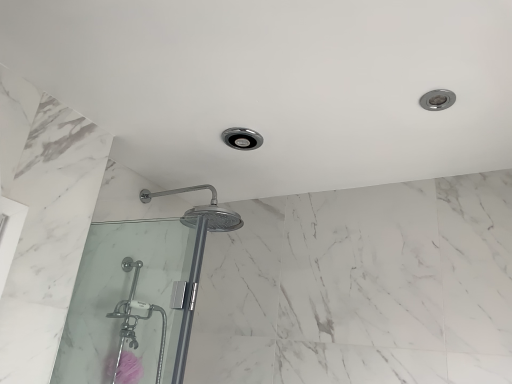
What is the approximate width of pink matte flower at lower left?

4.99 inches.

Describe the element at coordinates (128, 368) in the screenshot. The width and height of the screenshot is (512, 384). I see `pink matte flower at lower left` at that location.

Locate an element on the screen. pink matte flower at lower left is located at coordinates (128, 368).

The width and height of the screenshot is (512, 384). Describe the element at coordinates (133, 300) in the screenshot. I see `clear glass shower door at lower left` at that location.

Measure the distance between point (125, 270) and camera.

They are 5.64 feet apart.

Locate an element on the screen. This screenshot has height=384, width=512. clear glass shower door at lower left is located at coordinates click(x=133, y=300).

You are a GUI agent. You are given a task and a screenshot of the screen. Output one action in this format:
    pyautogui.click(x=<x>, y=<y>)
    Task: Click on the pink matte flower at lower left
    The image size is (512, 384).
    Given the screenshot: What is the action you would take?
    pyautogui.click(x=128, y=368)

Is clear glass shower door at lower left to the left of pink matte flower at lower left from the viewer's perspective?

No, clear glass shower door at lower left is not to the left of pink matte flower at lower left.

Is clear glass shower door at lower left closer to camera compared to pink matte flower at lower left?

Yes, it is.

Considering the points (119, 232) and (133, 370), which point is behind, point (119, 232) or point (133, 370)?

The point (119, 232) is more distant.

From the image's perspective, which is above, clear glass shower door at lower left or pink matte flower at lower left?

From the image's view, clear glass shower door at lower left is above.

From a real-world perspective, which object rests below the other?

In real-world perspective, pink matte flower at lower left is lower.

Does clear glass shower door at lower left have a lesser width compared to pink matte flower at lower left?

Yes.

Which of these two, clear glass shower door at lower left or pink matte flower at lower left, stands shorter?

Standing shorter between the two is pink matte flower at lower left.

Between clear glass shower door at lower left and pink matte flower at lower left, which one has larger size?

With larger size is clear glass shower door at lower left.

Is clear glass shower door at lower left inside the boundaries of pink matte flower at lower left, or outside?

clear glass shower door at lower left is not inside pink matte flower at lower left, it's outside.

Is clear glass shower door at lower left positioned far away from pink matte flower at lower left?

clear glass shower door at lower left is near pink matte flower at lower left, not far away.

Is clear glass shower door at lower left oriented towards pink matte flower at lower left?

No, clear glass shower door at lower left is not oriented towards pink matte flower at lower left.

You are a GUI agent. You are given a task and a screenshot of the screen. Output one action in this format:
    pyautogui.click(x=<x>, y=<y>)
    Task: Click on the screen door above the pink matte flower at lower left (from a real-world perspective)
    This screenshot has width=512, height=384.
    Given the screenshot: What is the action you would take?
    pyautogui.click(x=133, y=300)

Looking at this image, can you confirm if pink matte flower at lower left is positioned to the left of clear glass shower door at lower left?

Indeed, pink matte flower at lower left is positioned on the left side of clear glass shower door at lower left.

Considering the relative positions of pink matte flower at lower left and clear glass shower door at lower left in the image provided, is pink matte flower at lower left behind clear glass shower door at lower left?

Yes, pink matte flower at lower left is behind clear glass shower door at lower left.

Which is less distant, (123, 352) or (60, 354)?

Point (123, 352) is farther from the camera than point (60, 354).

From the image's perspective, is pink matte flower at lower left on clear glass shower door at lower left?

No, from the image's perspective, pink matte flower at lower left is not on top of clear glass shower door at lower left.

From a real-world perspective, is pink matte flower at lower left under clear glass shower door at lower left?

Indeed, from a real-world perspective, pink matte flower at lower left is positioned beneath clear glass shower door at lower left.

Looking at this image, does pink matte flower at lower left have a greater width compared to clear glass shower door at lower left?

Correct, the width of pink matte flower at lower left exceeds that of clear glass shower door at lower left.

Who is taller, pink matte flower at lower left or clear glass shower door at lower left?

Standing taller between the two is clear glass shower door at lower left.

Based on the photo, is pink matte flower at lower left bigger than clear glass shower door at lower left?

No.

Which is correct: pink matte flower at lower left is inside clear glass shower door at lower left, or outside of it?

pink matte flower at lower left exists outside the volume of clear glass shower door at lower left.

Can you see pink matte flower at lower left touching clear glass shower door at lower left?

There is a gap between pink matte flower at lower left and clear glass shower door at lower left.

Consider the image. Does pink matte flower at lower left turn towards clear glass shower door at lower left?

No, pink matte flower at lower left is not aimed at clear glass shower door at lower left.

Can you tell me how much pink matte flower at lower left and clear glass shower door at lower left differ in facing direction?

pink matte flower at lower left and clear glass shower door at lower left are facing 89.9 degrees away from each other.

The width and height of the screenshot is (512, 384). Find the location of `screen door above the pink matte flower at lower left (from a real-world perspective)`. screen door above the pink matte flower at lower left (from a real-world perspective) is located at coordinates (133, 300).

This screenshot has height=384, width=512. What are the coordinates of `flower that is on the left side of clear glass shower door at lower left` in the screenshot? It's located at (128, 368).

Where is `screen door above the pink matte flower at lower left (from the image's perspective)`? This screenshot has width=512, height=384. screen door above the pink matte flower at lower left (from the image's perspective) is located at coordinates (133, 300).